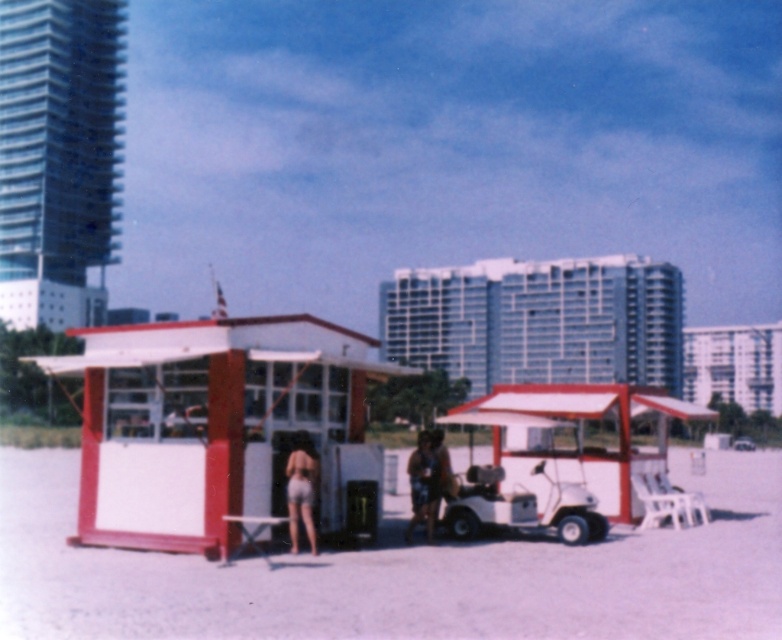
You are standing at the point marked as point (x=402, y=573). What object is located exactly at this point?

The white plastic chair at center is located exactly at point (x=402, y=573).

You are a beachgoer standing at the concession stand and want to place your light blue denim shorts at center on the white plastic chair at center. Can you easily reach the chair from your current position?

The white plastic chair at center is closer to the viewer than the light blue denim shorts at center, so the shorts are further away from you. You would need to move forward to reach the chair.

You are standing at the beach concession stand and want to walk towards the two points marked in the image. Which point, point (546, 566) or point (429, 520), is closer to you?

Point (546, 566) is in front of point (429, 520), so it is closer to you.